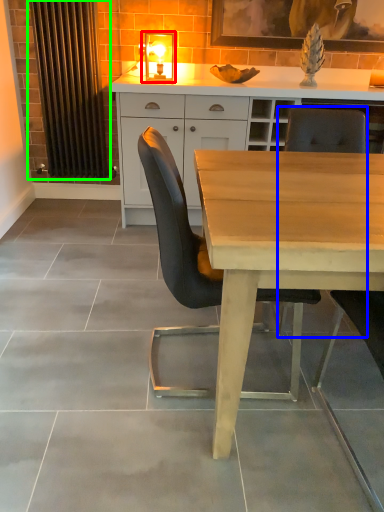
Question: Which object is positioned farthest from light fixture (highlighted by a red box)? Select from chair (highlighted by a blue box) and curtain (highlighted by a green box).

Choices:
 (A) chair
 (B) curtain

Answer: (A)